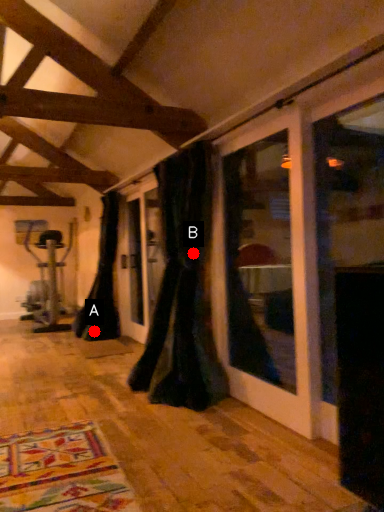
Question: Two points are circled on the image, labeled by A and B beside each circle. Which point is closer to the camera taking this photo?

Choices:
 (A) A is closer
 (B) B is closer

Answer: (B)